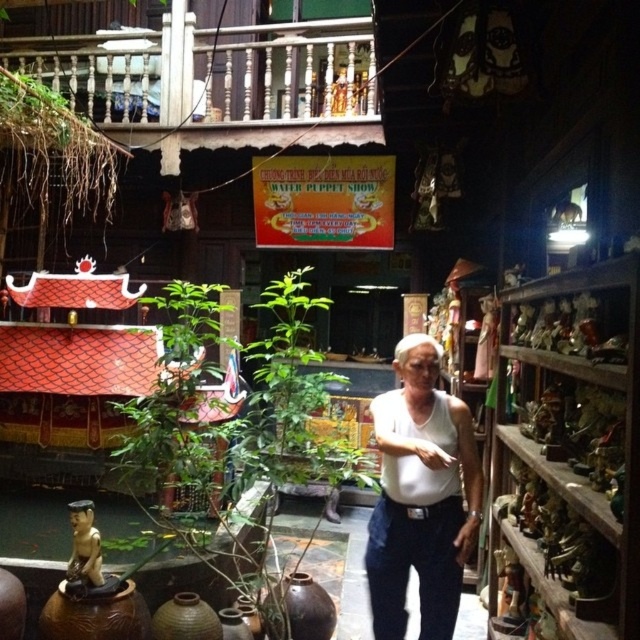
You are organizing items in the shop and need to place the green leafy plant at center and the white cotton tank top at center on a shelf. Which item requires more space?

The green leafy plant at center requires more space because it is bigger than the white cotton tank top at center.

You are a customer in the shop and want to pick up the white cotton tank top at center. Is it currently under the green leafy plant at center?

Yes, the white cotton tank top at center is under the green leafy plant at center because the green leafy plant at center is positioned over it.

You are standing in the middle of the shop and want to place a decorative item on the green leafy plant at center. According to the coordinates provided, is the plant positioned closer to the left or right side of the room?

The green leafy plant at center is located at point 0.625 on the x coordinate, which means it is closer to the right side of the room.